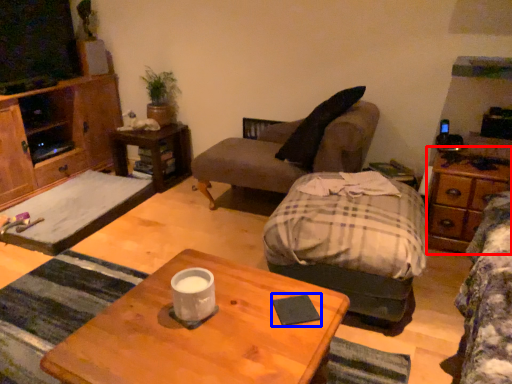
Question: Among these objects, which one is nearest to the camera, dresser (highlighted by a red box) or pad (highlighted by a blue box)?

Choices:
 (A) dresser
 (B) pad

Answer: (B)